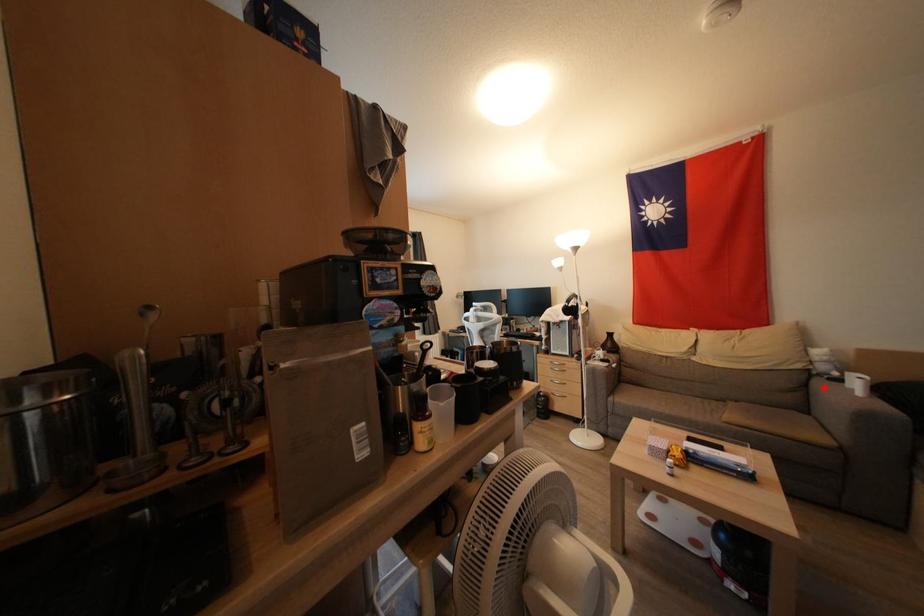
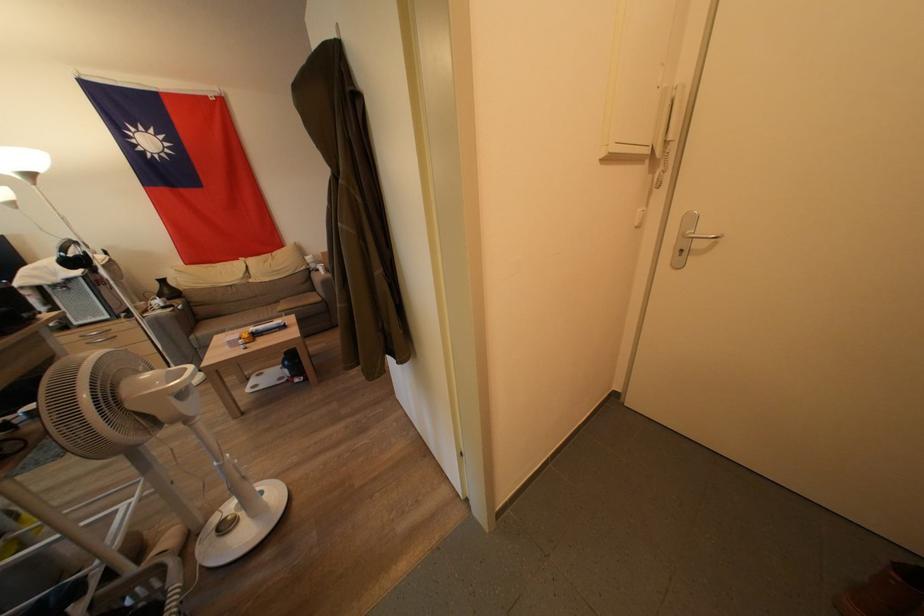
In the second image, find the point that corresponds to the highlighted location in the first image.

(319, 278)